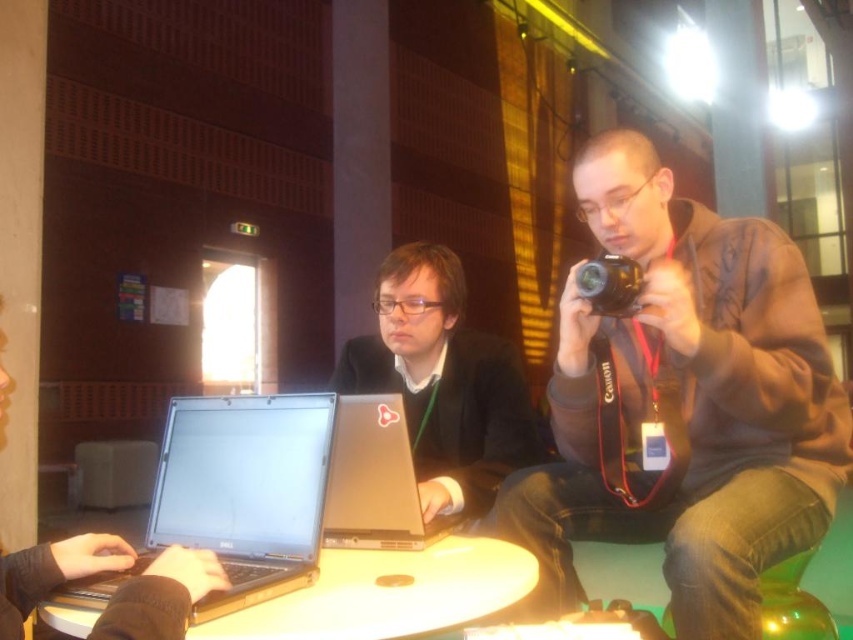
Question: Which object is farther from the camera taking this photo?

Choices:
 (A) matte black laptop at center
 (B) brown leather jacket at center
 (C) black plastic camera at right

Answer: (A)

Question: Which point is closer to the camera?

Choices:
 (A) silver metallic laptop at lower left
 (B) silver metallic laptop at center
 (C) black plastic camera at right

Answer: (A)

Question: Can you confirm if matte black laptop at center is thinner than black plastic camera at right?

Choices:
 (A) no
 (B) yes

Answer: (A)

Question: Estimate the real-world distances between objects in this image. Which object is farther from the silver metallic laptop at center?

Choices:
 (A) black plastic camera at right
 (B) matte black laptop at center

Answer: (A)

Question: Can you confirm if brown leather jacket at center is positioned to the right of white glossy round table at center?

Choices:
 (A) no
 (B) yes

Answer: (B)

Question: Is silver metallic laptop at lower left bigger than black plastic camera at right?

Choices:
 (A) yes
 (B) no

Answer: (A)